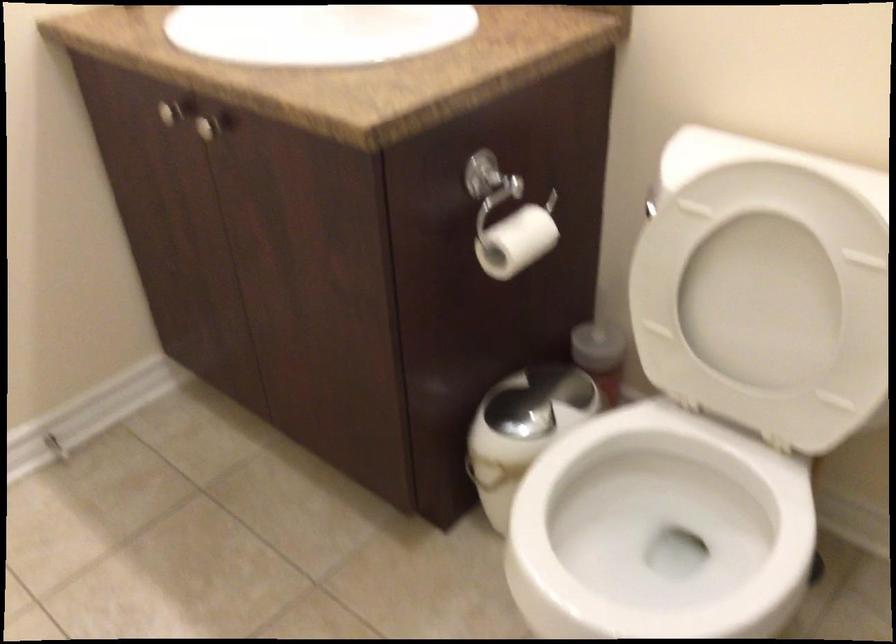
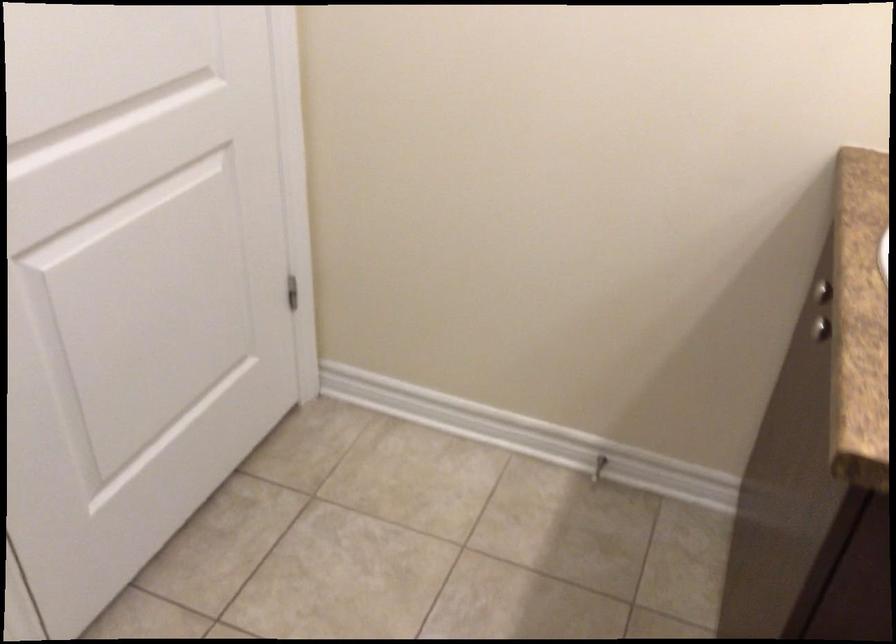
First-person continuous shooting, in which direction is the camera rotating?

The camera's rotation is toward left-down.